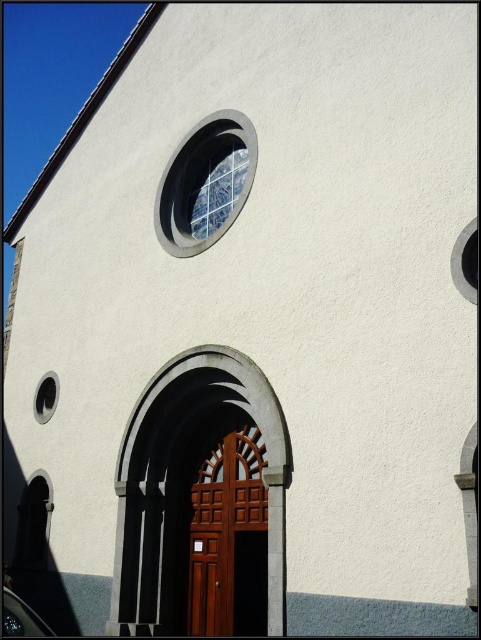
Consider the image. Does clear glass window at upper center appear on the left side of transparent glass window at lower left?

Incorrect, clear glass window at upper center is not on the left side of transparent glass window at lower left.

Is the position of clear glass window at upper center more distant than that of transparent glass window at lower left?

No.

Between point (242, 193) and point (35, 392), which one is positioned in front?

Point (242, 193) is more forward.

Image resolution: width=481 pixels, height=640 pixels. In order to click on clear glass window at upper center in this screenshot , I will do `click(205, 182)`.

Does polished wood door at center have a lesser width compared to transparent glass window at lower left?

No.

Does polished wood door at center lie in front of transparent glass window at lower left?

Yes, polished wood door at center is closer to the viewer.

Identify the location of polished wood door at center. The image size is (481, 640). (228, 540).

Identify the location of polished wood door at center. This screenshot has width=481, height=640. (228, 540).

How much distance is there between polished wood door at center and clear glass window at upper center?

A distance of 38.09 feet exists between polished wood door at center and clear glass window at upper center.

Does polished wood door at center have a larger size compared to clear glass window at upper center?

Incorrect, polished wood door at center is not larger than clear glass window at upper center.

Identify the location of polished wood door at center. (228, 540).